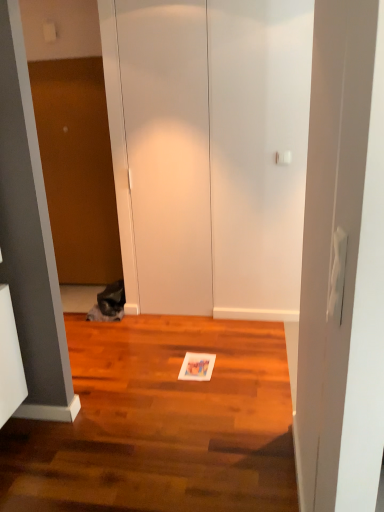
Question: Is brown matte door at left to the left of shiny brown hardwood floor at center from the viewer's perspective?

Choices:
 (A) no
 (B) yes

Answer: (B)

Question: Is brown matte door at left with shiny brown hardwood floor at center?

Choices:
 (A) yes
 (B) no

Answer: (B)

Question: Is brown matte door at left at the right side of shiny brown hardwood floor at center?

Choices:
 (A) yes
 (B) no

Answer: (B)

Question: From a real-world perspective, does brown matte door at left stand above shiny brown hardwood floor at center?

Choices:
 (A) no
 (B) yes

Answer: (B)

Question: Can you confirm if brown matte door at left is shorter than shiny brown hardwood floor at center?

Choices:
 (A) yes
 (B) no

Answer: (B)

Question: From the image's perspective, is brown matte door at left on top of shiny brown hardwood floor at center?

Choices:
 (A) yes
 (B) no

Answer: (A)

Question: Considering the relative sizes of brown matte door at left and white matte door at center in the image provided, is brown matte door at left wider than white matte door at center?

Choices:
 (A) no
 (B) yes

Answer: (B)

Question: Does brown matte door at left have a smaller size compared to white matte door at center?

Choices:
 (A) no
 (B) yes

Answer: (A)

Question: Is brown matte door at left directly adjacent to white matte door at center?

Choices:
 (A) yes
 (B) no

Answer: (B)

Question: Is brown matte door at left oriented towards white matte door at center?

Choices:
 (A) yes
 (B) no

Answer: (B)

Question: From the image's perspective, does brown matte door at left appear lower than white matte door at center?

Choices:
 (A) no
 (B) yes

Answer: (A)

Question: Considering the relative sizes of brown matte door at left and white matte door at center in the image provided, is brown matte door at left bigger than white matte door at center?

Choices:
 (A) no
 (B) yes

Answer: (B)

Question: Does fuzzy gray cat at left contain white matte door at center?

Choices:
 (A) yes
 (B) no

Answer: (B)